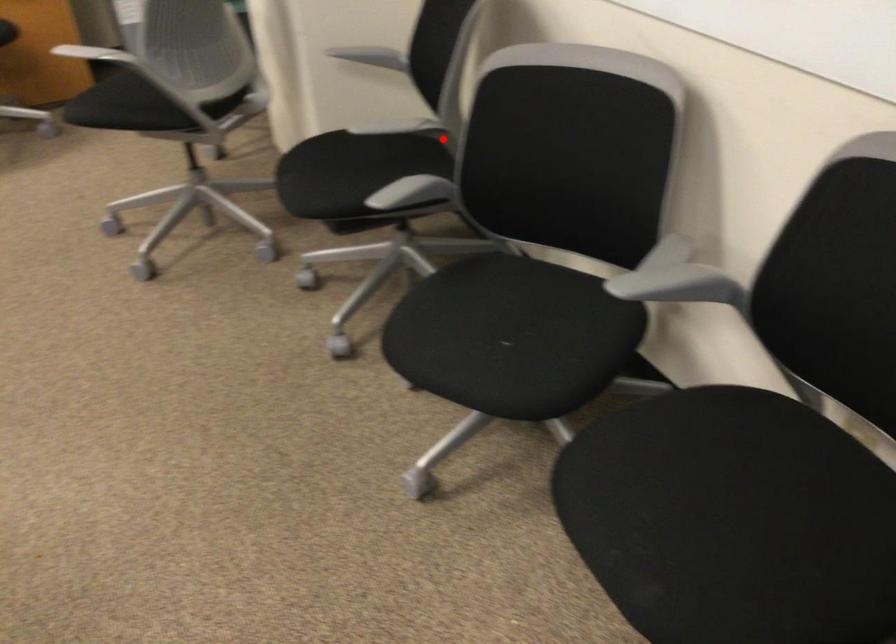
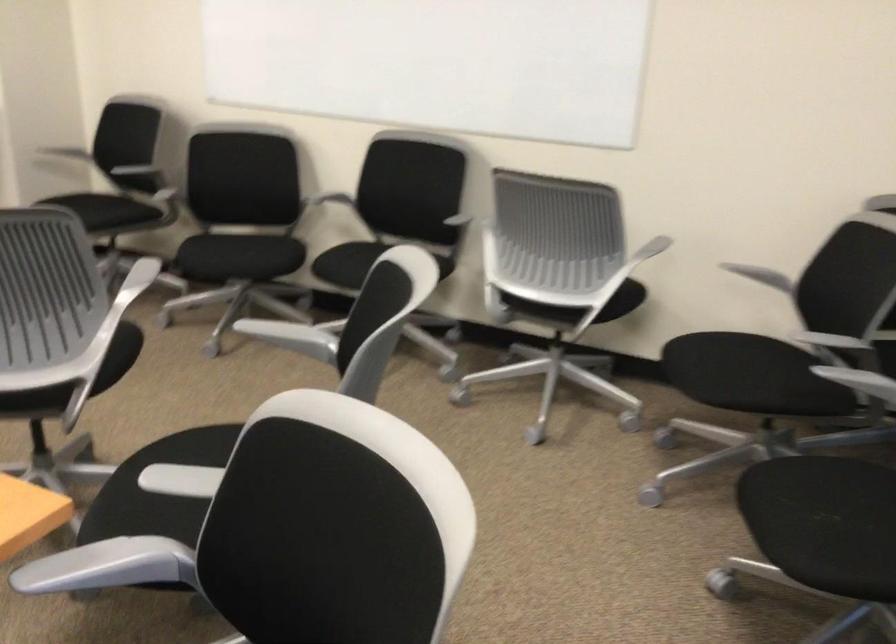
Question: I am providing you with two images of the same scene from different viewpoints. A red point is shown in image1. For the corresponding object point in image2, is it positioned nearer or farther from the camera?

Choices:
 (A) Nearer
 (B) Farther

Answer: (B)